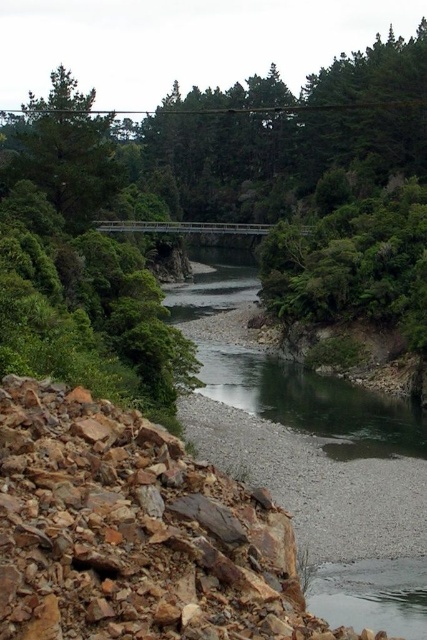
You are standing at the origin point of the image. Based on the scene description, where is the gray gravel stream at center located in terms of its 2D coordinates?

The gray gravel stream at center is located at the 2D coordinates of point (318, 412).

You are standing at the origin point of the image. Which direction should you move to reach the gray gravel stream at center?

The gray gravel stream at center is located at point 0.644 on the x axis and 0.745 on the y axis, so you should move to the right and forward to reach it.

You are a hiker planning to cross the river using the stones. You see the green leafy tree at center and the green matte tree at upper left. Which tree is wider?

The green leafy tree at center is narrower than the green matte tree at upper left, so the green matte tree at upper left is wider.